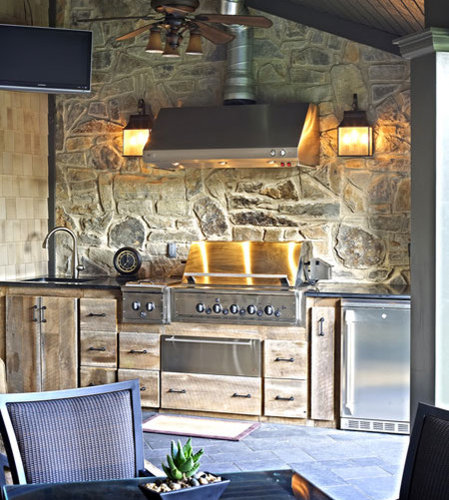
Where is `screen`? The image size is (449, 500). screen is located at coordinates (65, 56).